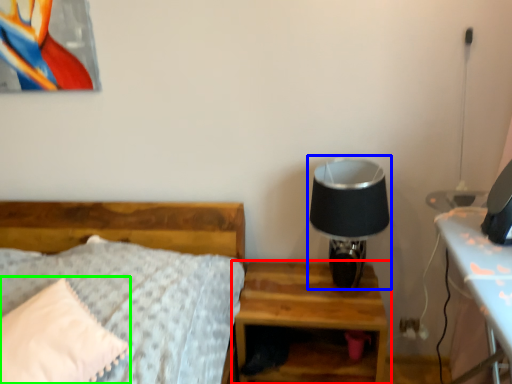
Question: Which object is the closest to the nightstand (highlighted by a red box)? Choose among these: table lamp (highlighted by a blue box) or pillow (highlighted by a green box).

Choices:
 (A) table lamp
 (B) pillow

Answer: (A)